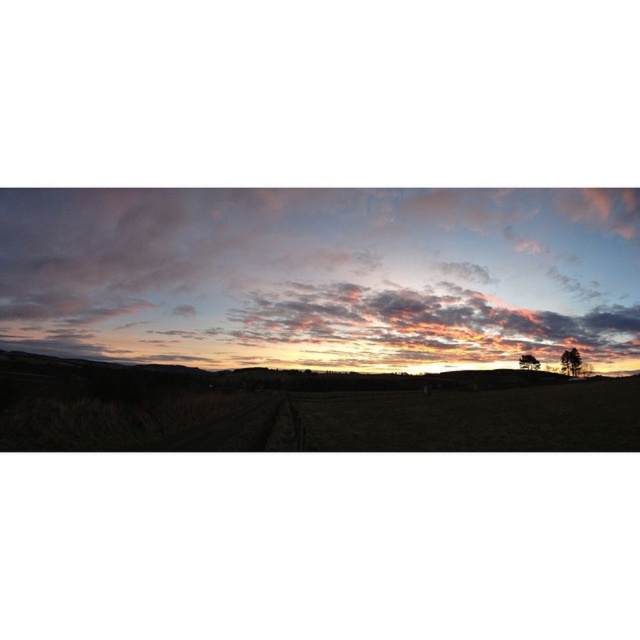
You are an artist painting the landscape and want to add a bird flying between the pastel cotton clouds at upper center and the green matte tree at right. Which object will the bird appear closer to in your painting?

The bird will appear closer to the pastel cotton clouds at upper center because they are in front of the green matte tree at right.

Looking at this image, you are an artist painting the rural landscape scene. You want to ensure the pastel cotton clouds at upper center and the green leafy tree at lower right are proportionally accurate. Which object should you paint larger?

The pastel cotton clouds at upper center should be painted larger since they are bigger than the green leafy tree at lower right according to the scene description.

You are standing at the center of the image and want to walk towards the green matte tree at right. Which direction should you face to head directly towards it?

The green matte tree at right is located at point 0.566 on the x axis and 0.892 on the y axis. Since you are at the center, you should face towards the right and slightly upwards to head directly towards the green matte tree at right.